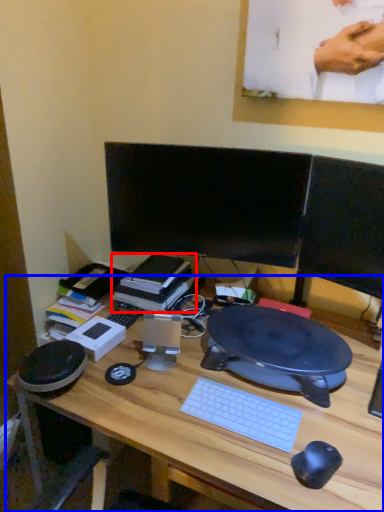
Question: Which object is further to the camera taking this photo, book (highlighted by a red box) or desk (highlighted by a blue box)?

Choices:
 (A) book
 (B) desk

Answer: (A)